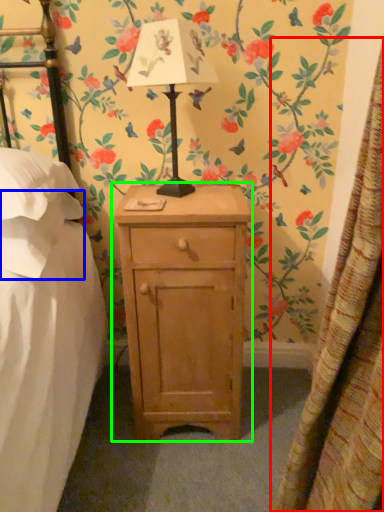
Question: Considering the real-world distances, which object is farthest from curtain (highlighted by a red box)? pillow (highlighted by a blue box) or nightstand (highlighted by a green box)?

Choices:
 (A) pillow
 (B) nightstand

Answer: (A)